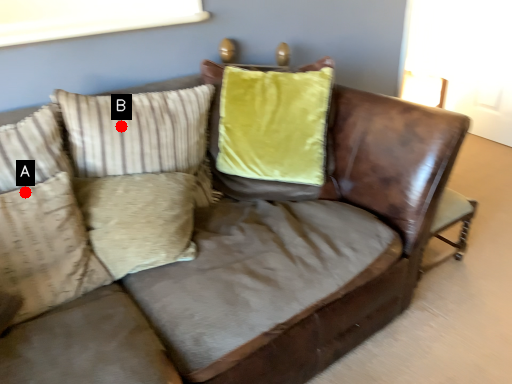
Question: Two points are circled on the image, labeled by A and B beside each circle. Which of the following is the farthest from the observer?

Choices:
 (A) A is further
 (B) B is further

Answer: (B)